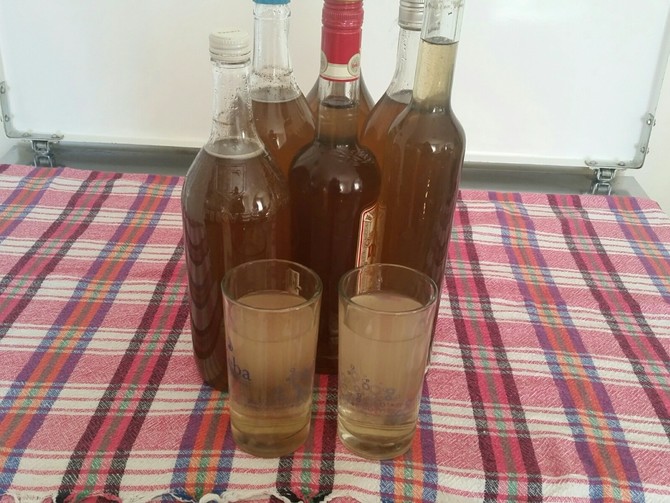
This screenshot has width=670, height=503. Identify the location of bottles. (425, 197), (376, 127), (366, 92), (330, 181), (287, 130), (242, 189).